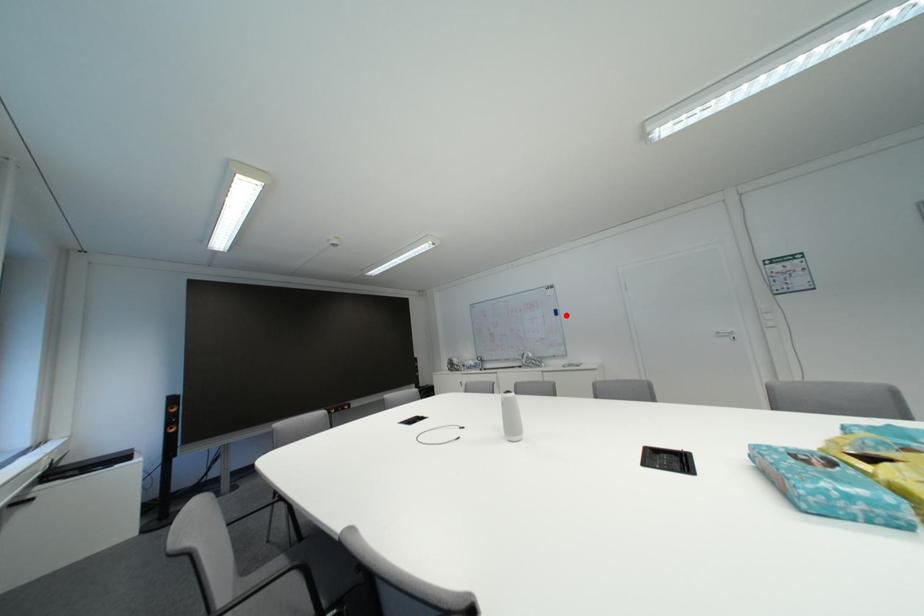
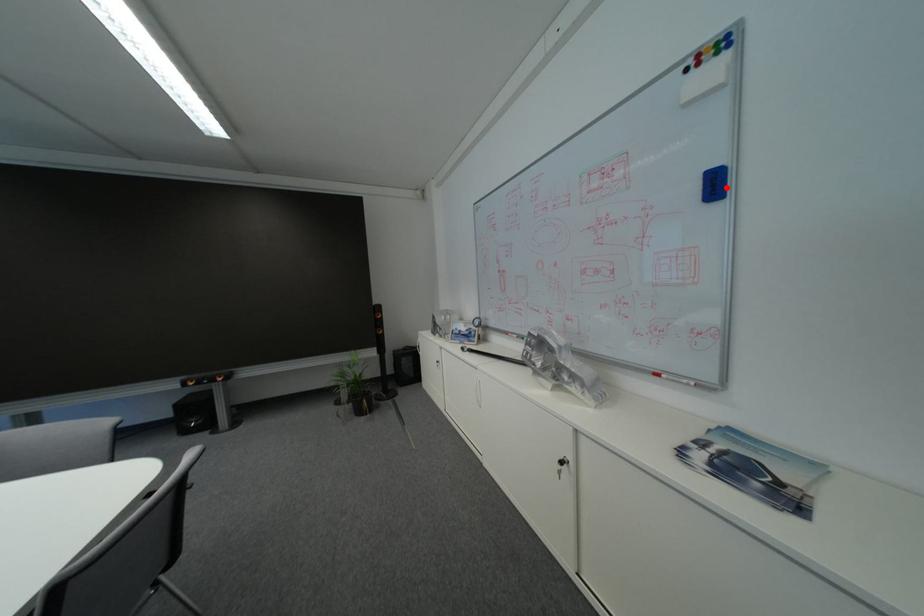
I am providing you with two images of the same scene from different viewpoints. A red point is marked on the first image and another point is marked on the second image. Does the point marked in image1 correspond to the same location as the one in image2?

Yes